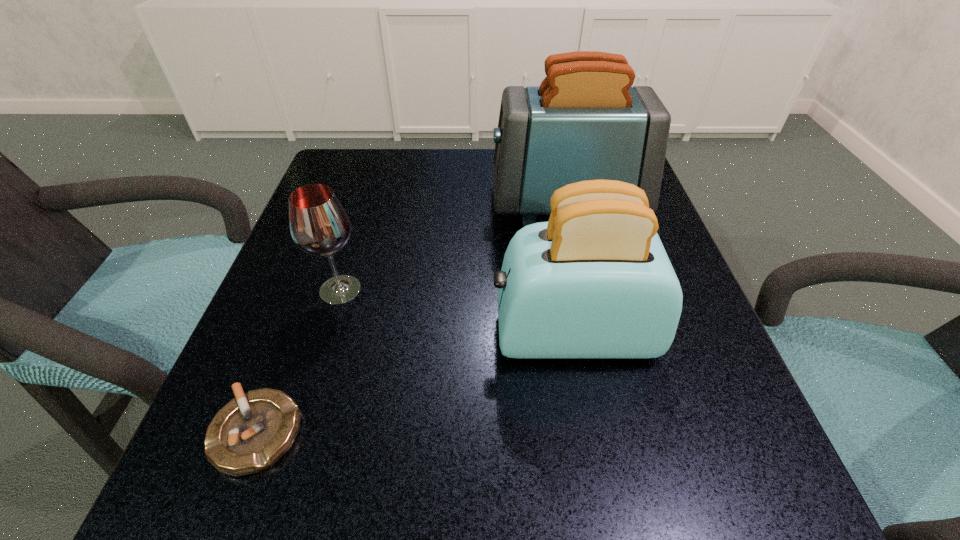
Locate an element on the screen. Image resolution: width=960 pixels, height=540 pixels. free space located on the side of the nearer toaster with the lever is located at coordinates (436, 334).

This screenshot has height=540, width=960. I want to click on vacant space located on the back of the second shortest object, so click(361, 224).

This screenshot has height=540, width=960. I want to click on free space located on the back of the shortest object, so click(x=304, y=303).

Find the location of a particular element. The height and width of the screenshot is (540, 960). object that is at the far edge is located at coordinates (584, 122).

Where is `object located in the near edge section of the desktop`? This screenshot has height=540, width=960. object located in the near edge section of the desktop is located at coordinates (248, 435).

This screenshot has height=540, width=960. Find the location of `wineglass that is at the left edge`. wineglass that is at the left edge is located at coordinates (319, 225).

The image size is (960, 540). What are the coordinates of `ashtray located at the left edge` in the screenshot? It's located at (248, 435).

The height and width of the screenshot is (540, 960). I want to click on object situated at the near left corner, so click(248, 435).

The image size is (960, 540). I want to click on object that is at the far right corner, so click(x=584, y=122).

This screenshot has height=540, width=960. In the image, there is a desktop. In order to click on vacant space at the far edge in this screenshot , I will do `click(444, 148)`.